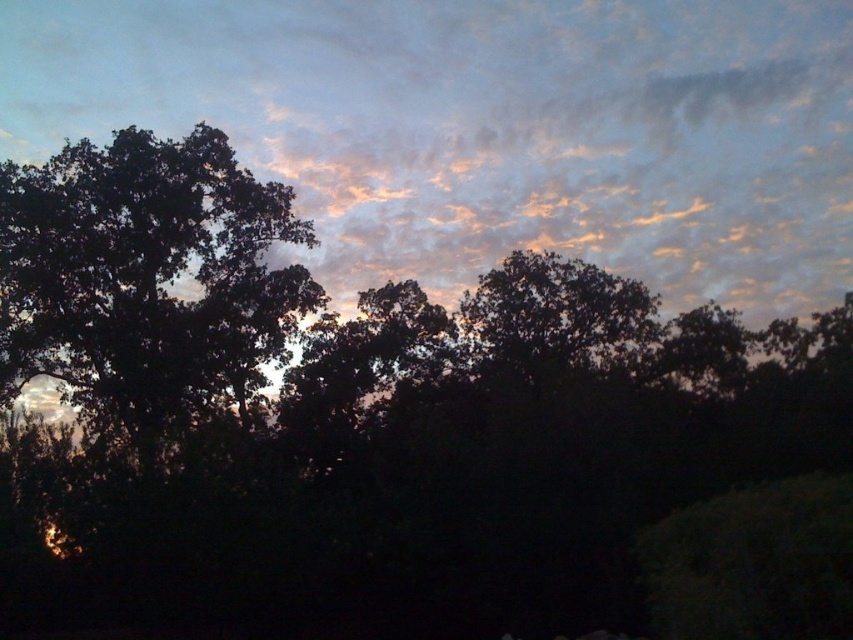
You are an astronomer observing the twilight sky. You notice a point in the sky at coordinates point (486, 129). What object is located at that point?

At point (486, 129) lies a matte orange cloud at upper center.

Looking at this image, you are an astronomer observing the twilight sky. You notice the matte orange cloud at upper center and the dark green leafy tree at left. Which object would appear bigger in your telescope if you focus on both?

The matte orange cloud at upper center is larger in size than the dark green leafy tree at left, so it would appear bigger in the telescope.